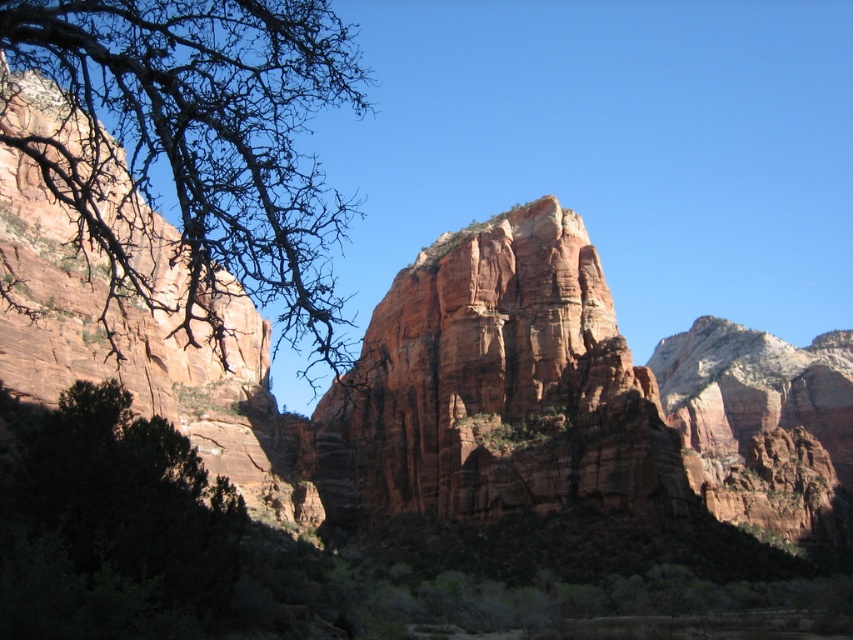
You are standing at the point marked by coordinates point (200, 140) in the image. Looking around, you notice the dense cluster of dark green foliage in the foreground. Which direction should you walk to reach the dense cluster of dark green foliage?

The point (200, 140) marks bare branches at left. To reach the dense cluster of dark green foliage in the foreground, you should walk towards the center or right direction since the foliage is in the foreground and the branches are on the left.